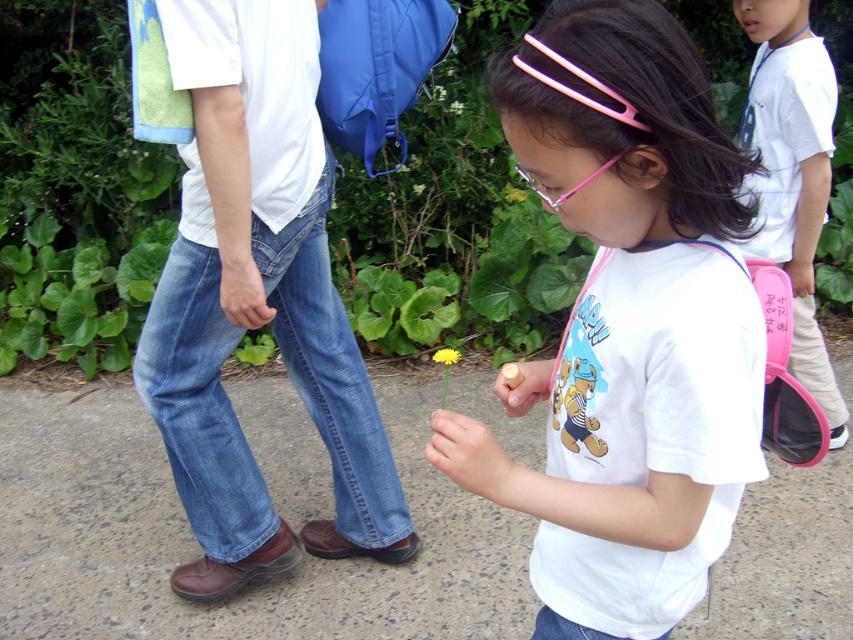
Question: Is pink plastic goggles at center behind yellow matte flower at center?

Choices:
 (A) no
 (B) yes

Answer: (A)

Question: Which object is positioned closest to the pink plastic goggles at center?

Choices:
 (A) yellow matte flower at center
 (B) pink plastic hair clip at upper center
 (C) pink fabric backpack at right
 (D) gray concrete pavement at center

Answer: (B)

Question: Can you confirm if gray concrete pavement at center is positioned below pink fabric backpack at right?

Choices:
 (A) yes
 (B) no

Answer: (A)

Question: Can you confirm if pink fabric backpack at right is smaller than yellow matte dandelion at center?

Choices:
 (A) no
 (B) yes

Answer: (A)

Question: Among these objects, which one is farthest from the camera?

Choices:
 (A) pink fabric backpack at right
 (B) yellow matte dandelion at center
 (C) pink plastic hair clip at upper center
 (D) pink plastic goggles at center

Answer: (A)

Question: Among these objects, which one is nearest to the camera?

Choices:
 (A) gray concrete pavement at center
 (B) pink plastic hair clip at upper center
 (C) yellow matte flower at center

Answer: (B)